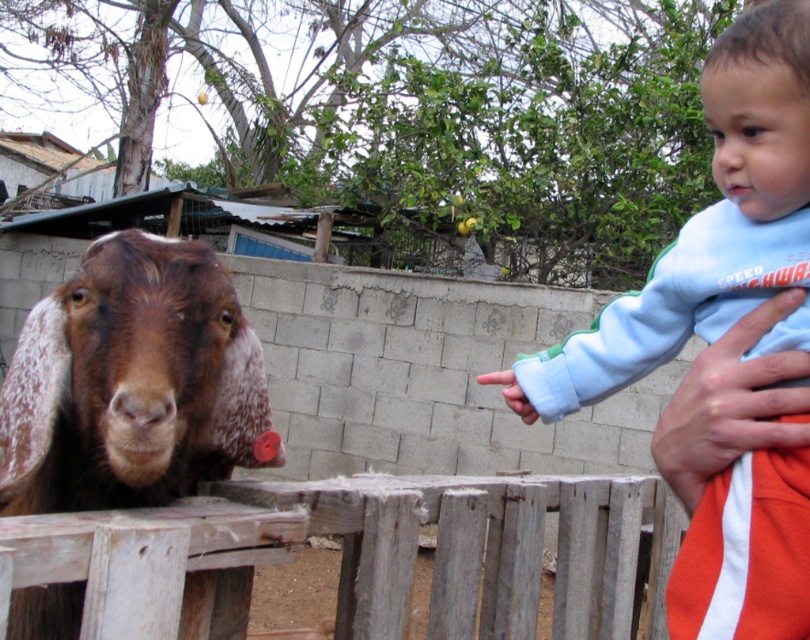
You are a delivery drone with a wingspan of 30 centimeters. You need to fly through the gap between the weathered wood fence at center and the brown speckled fur at left. Can your drone safely pass through this gap?

The gap between the weathered wood fence at center and the brown speckled fur at left is 39.34 centimeters. Since your drone has a wingspan of 30 centimeters, it can safely pass through the gap as the distance is wider than the drone.

You are standing in the scene and want to reach the goat behind the weathered wood fence at center. What is the shortest path to get to the goat without climbing over the fence?

The shortest path to reach the goat behind the weathered wood fence at center would be to go around the fence to the left or right since the fence is positioned in the center and you can walk around it to approach the goat without climbing.